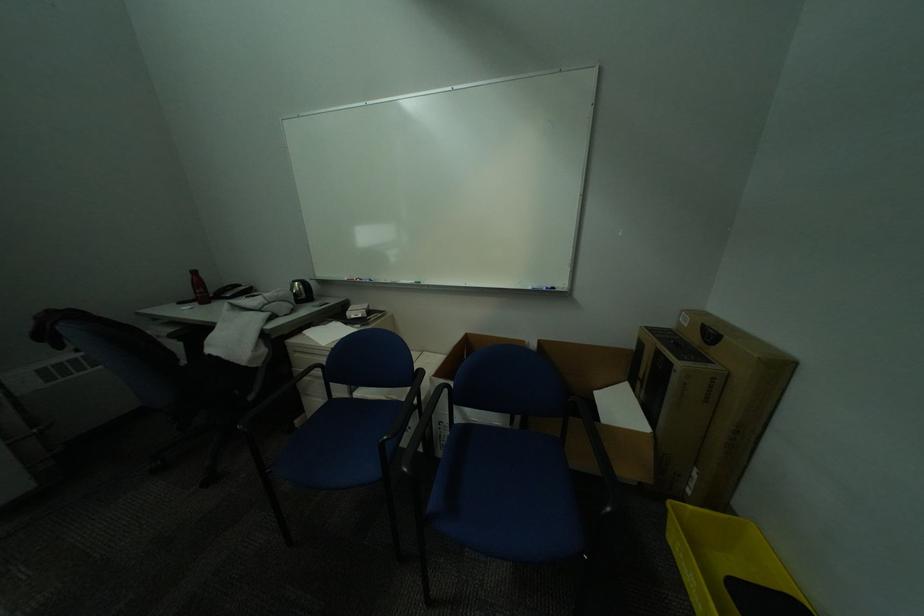
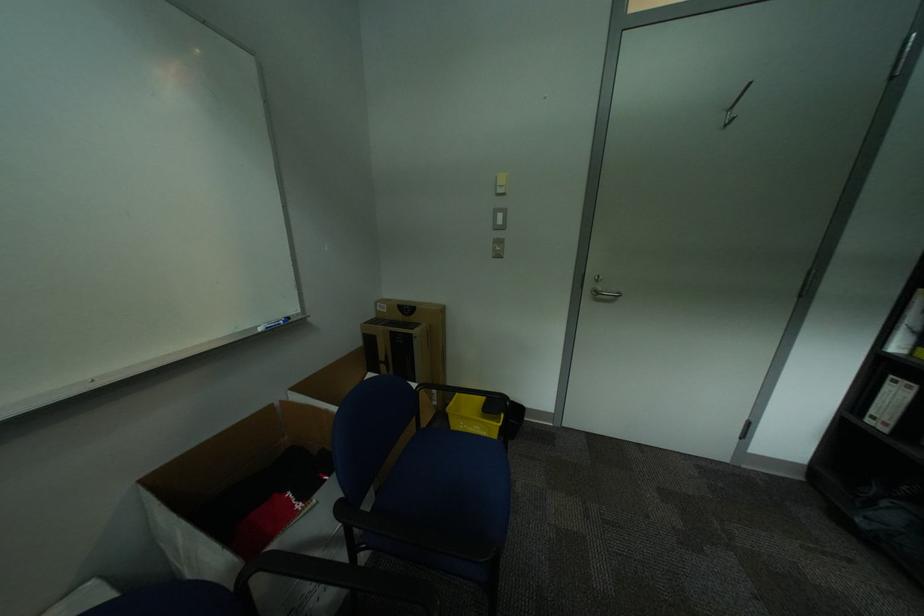
Find the pixel in the second image that matches point 699,493 in the first image.

(445, 403)